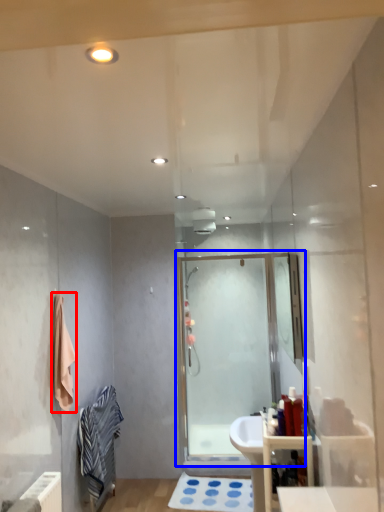
Question: Which object is closer to the camera taking this photo, bath towel (highlighted by a red box) or screen door (highlighted by a blue box)?

Choices:
 (A) bath towel
 (B) screen door

Answer: (A)